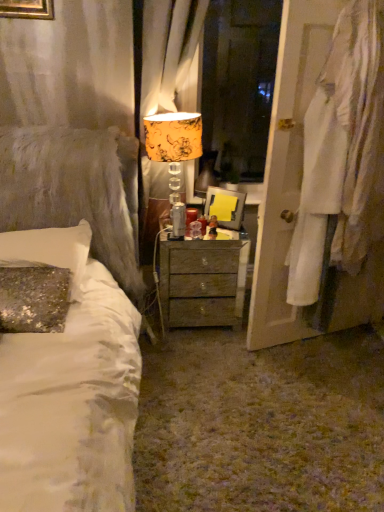
At what (x,y) coordinates should I click in order to perform the action: click on free point below wooden nightstand at center (from a real-world perspective). Please return your answer as a coordinate pair (x, y). Looking at the image, I should click on (197, 328).